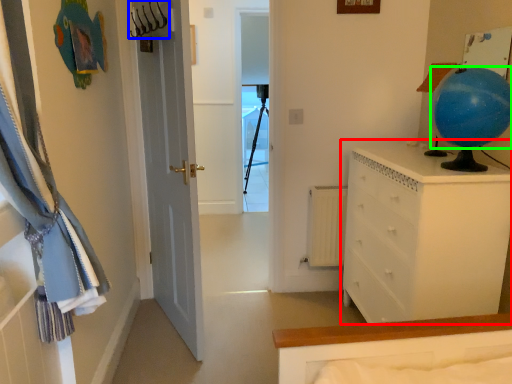
Question: Based on their relative distances, which object is farther from chest of drawers (highlighted by a red box)? Choose from hanger (highlighted by a blue box) and balloon (highlighted by a green box).

Choices:
 (A) hanger
 (B) balloon

Answer: (A)